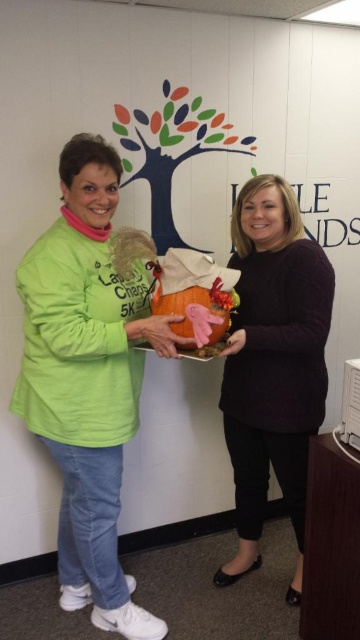
The width and height of the screenshot is (360, 640). Describe the element at coordinates (87, 380) in the screenshot. I see `matte green shirt at left` at that location.

The image size is (360, 640). Identify the location of matte green shirt at left. (87, 380).